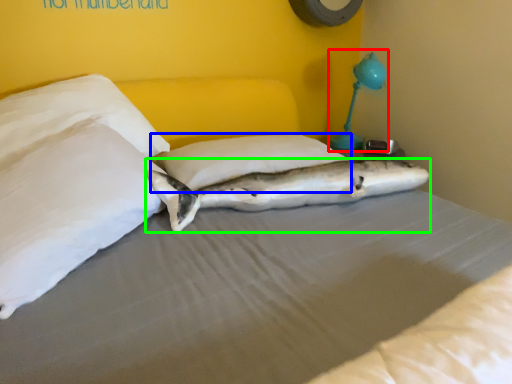
Question: Which object is the farthest from table lamp (highlighted by a red box)? Choose among these: pillow (highlighted by a blue box) or shark (highlighted by a green box).

Choices:
 (A) pillow
 (B) shark

Answer: (B)